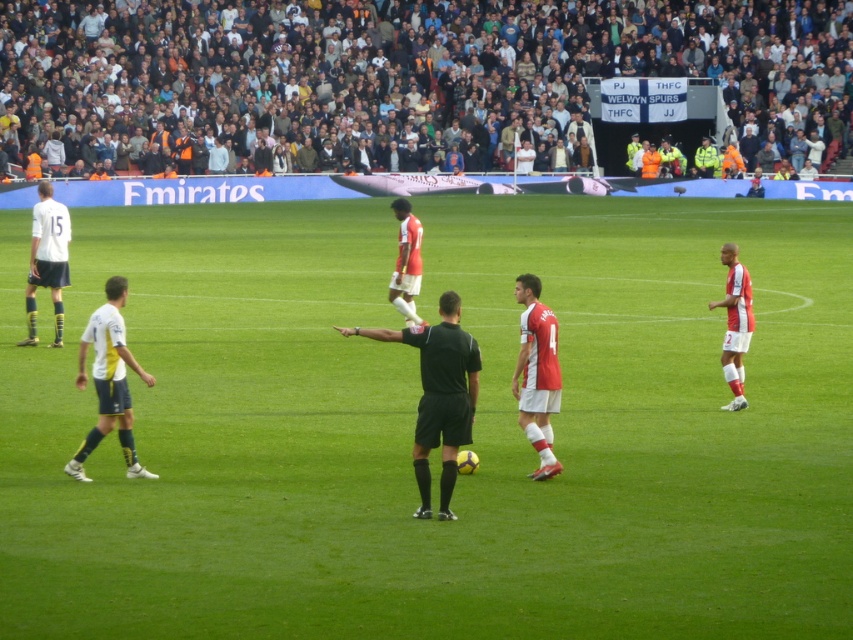
Which is below, black fabric referee at center or white jersey at right?

black fabric referee at center is below.

Which is more to the left, black fabric referee at center or white jersey at right?

black fabric referee at center is more to the left.

Image resolution: width=853 pixels, height=640 pixels. Describe the element at coordinates (438, 394) in the screenshot. I see `black fabric referee at center` at that location.

This screenshot has height=640, width=853. What are the coordinates of `black fabric referee at center` in the screenshot? It's located at (438, 394).

Does black shorts at center have a lesser width compared to white jersey at left?

Incorrect, black shorts at center's width is not less than white jersey at left's.

Between black shorts at center and white jersey at left, which one is positioned higher?

black shorts at center is higher up.

Which is behind, point (677, 12) or point (114, 392)?

Positioned behind is point (677, 12).

This screenshot has height=640, width=853. What are the coordinates of `black shorts at center` in the screenshot? It's located at (410, 67).

Can you confirm if black shorts at center is taller than white matte shorts at left?

Correct, black shorts at center is much taller as white matte shorts at left.

Is black shorts at center wider than white matte shorts at left?

Indeed, black shorts at center has a greater width compared to white matte shorts at left.

Is point (529, 70) farther from camera compared to point (51, 252)?

Yes, it is.

Identify the location of black shorts at center. The width and height of the screenshot is (853, 640). (410, 67).